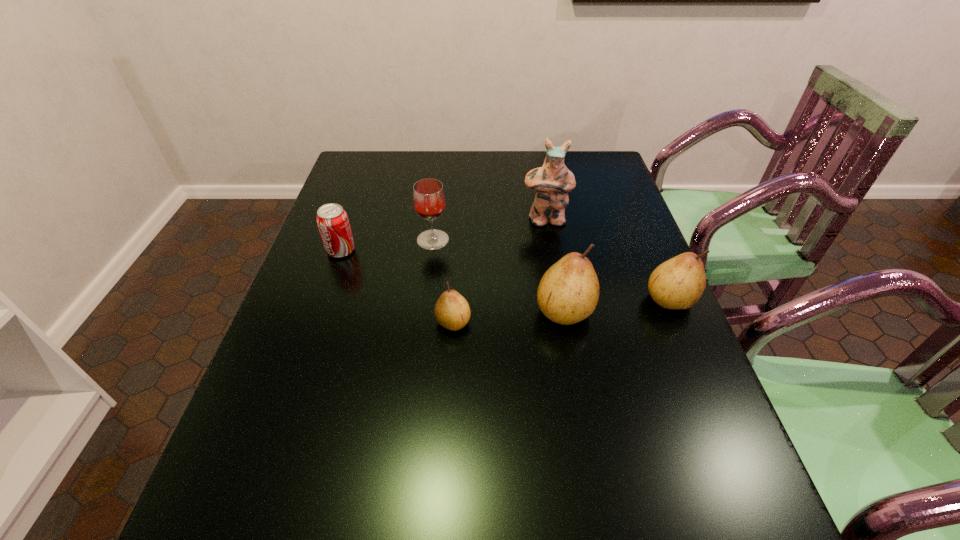
Considering the uniform spacing of pears, where should an additional pear be positioned on the left? Please locate a free spot. Please provide its 2D coordinates. Your answer should be formatted as a tuple, i.e. [(x, y)], where the tuple contains the x and y coordinates of a point satisfying the conditions above.

[(336, 334)]